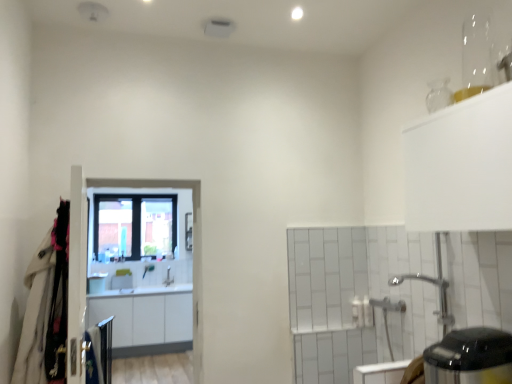
Question: Could you tell me if white fabric coat at left is turned towards white glossy screen door at center?

Choices:
 (A) yes
 (B) no

Answer: (B)

Question: Is white fabric coat at left turned away from white glossy screen door at center?

Choices:
 (A) no
 (B) yes

Answer: (A)

Question: From a real-world perspective, does white fabric coat at left stand above white glossy screen door at center?

Choices:
 (A) yes
 (B) no

Answer: (B)

Question: From the image's perspective, does white fabric coat at left appear lower than white glossy screen door at center?

Choices:
 (A) yes
 (B) no

Answer: (A)

Question: Is white fabric coat at left shorter than white glossy screen door at center?

Choices:
 (A) yes
 (B) no

Answer: (A)

Question: Is silver metallic faucet at center taller or shorter than white glossy cabinets at center?

Choices:
 (A) tall
 (B) short

Answer: (B)

Question: From a real-world perspective, is silver metallic faucet at center physically located above or below white glossy cabinets at center?

Choices:
 (A) above
 (B) below

Answer: (A)

Question: In the image, is silver metallic faucet at center positioned in front of or behind white glossy cabinets at center?

Choices:
 (A) behind
 (B) front

Answer: (A)

Question: Considering the positions of silver metallic faucet at center and white glossy cabinets at center in the image, is silver metallic faucet at center bigger or smaller than white glossy cabinets at center?

Choices:
 (A) small
 (B) big

Answer: (A)

Question: Considering the positions of silver metallic faucet at center and black glossy electric kettle at lower right in the image, is silver metallic faucet at center taller or shorter than black glossy electric kettle at lower right?

Choices:
 (A) short
 (B) tall

Answer: (B)

Question: Does point (173, 279) appear closer or farther from the camera than point (449, 347)?

Choices:
 (A) farther
 (B) closer

Answer: (A)

Question: Considering their positions, is silver metallic faucet at center located in front of or behind black glossy electric kettle at lower right?

Choices:
 (A) front
 (B) behind

Answer: (B)

Question: From the image's perspective, is silver metallic faucet at center located above or below black glossy electric kettle at lower right?

Choices:
 (A) above
 (B) below

Answer: (B)

Question: Is white glossy screen door at center in front of or behind white glossy cabinets at center in the image?

Choices:
 (A) front
 (B) behind

Answer: (A)

Question: Looking at the image, does white glossy screen door at center seem bigger or smaller compared to white glossy cabinets at center?

Choices:
 (A) small
 (B) big

Answer: (A)